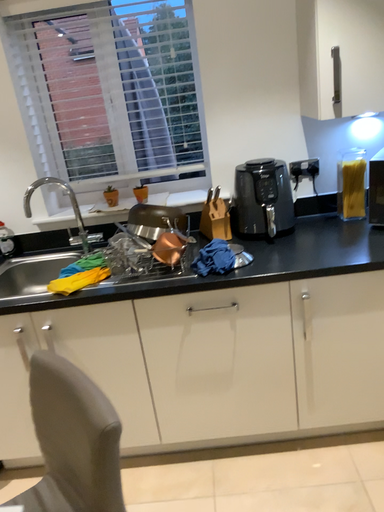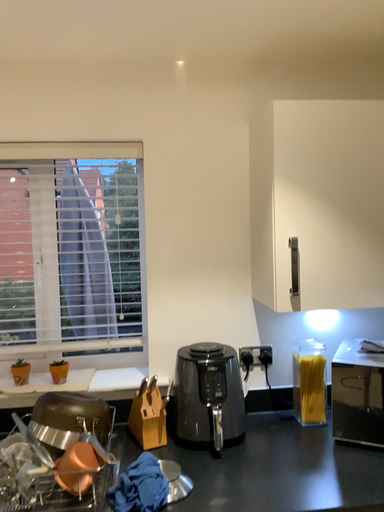
Question: How did the camera likely rotate when shooting the video?

Choices:
 (A) rotated left
 (B) rotated right

Answer: (B)